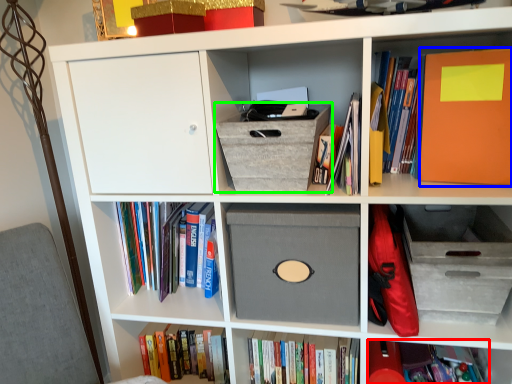
Question: Estimate the real-world distances between objects in this image. Which object is farther from book (highlighted by a red box), paperback book (highlighted by a blue box) or shoe box (highlighted by a green box)?

Choices:
 (A) paperback book
 (B) shoe box

Answer: (B)